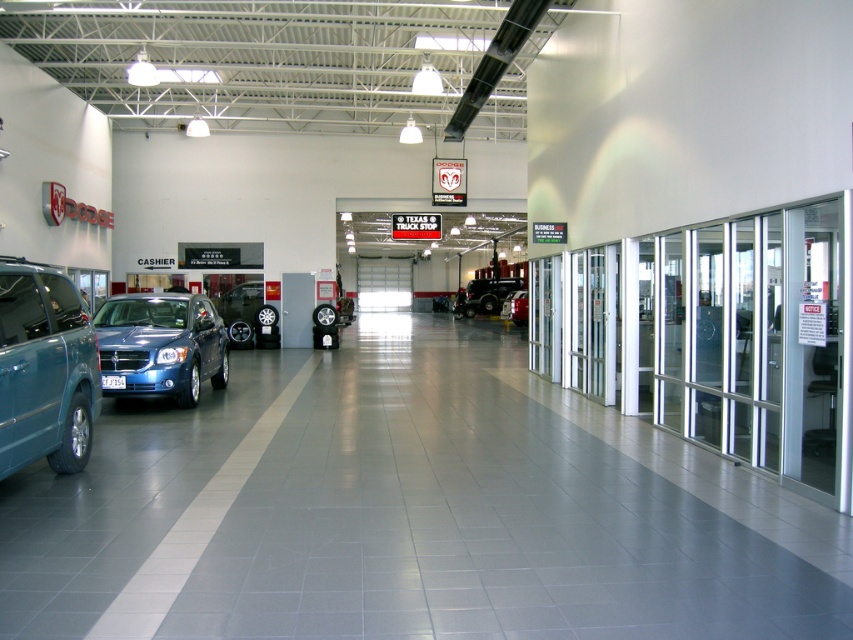
What are the coordinates of the matte black suv at left in the Dodge dealership showroom?

The matte black suv at left is located at coordinates point (44, 369).